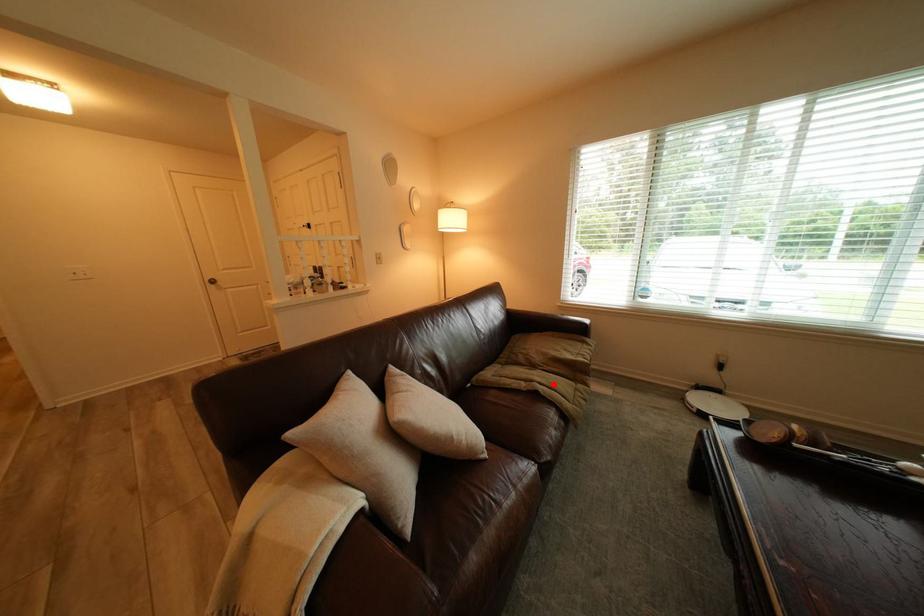
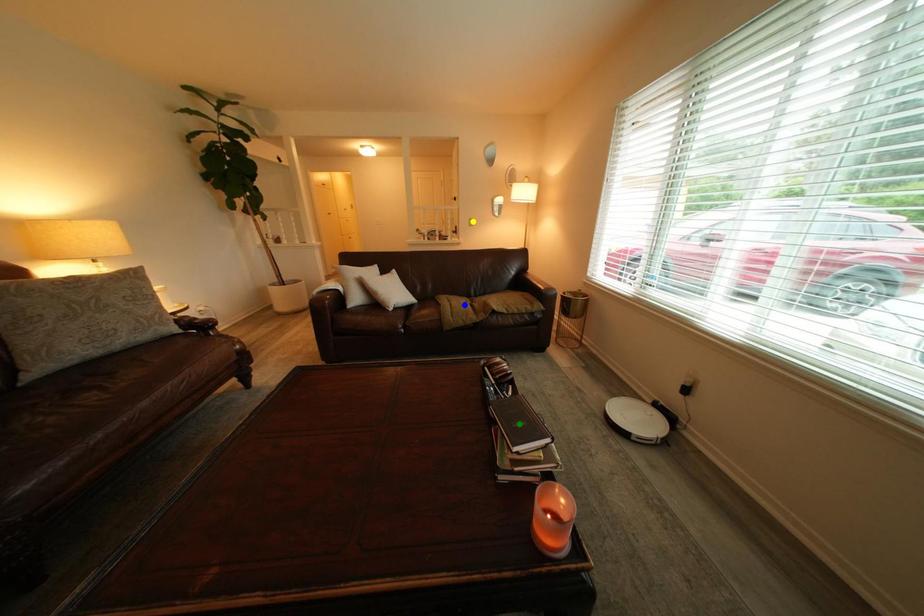
Question: I am providing you with two images of the same scene from different viewpoints. A red point is marked on the first image. You are given multiple points on the second image. Can you choose the point in image 2 that corresponds to the point in image 1?

Choices:
 (A) green point
 (B) yellow point
 (C) blue point

Answer: (C)